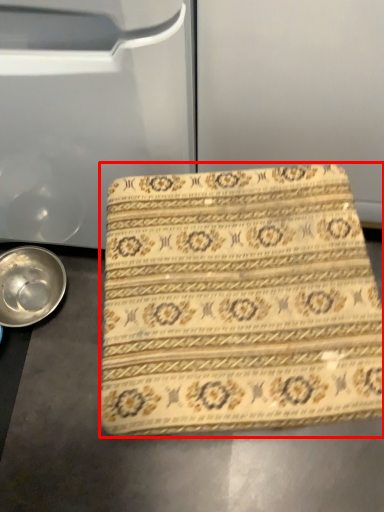
Question: From the image, what is the correct spatial relationship of beach towel (annotated by the red box) in relation to bowl?

Choices:
 (A) left
 (B) right

Answer: (B)